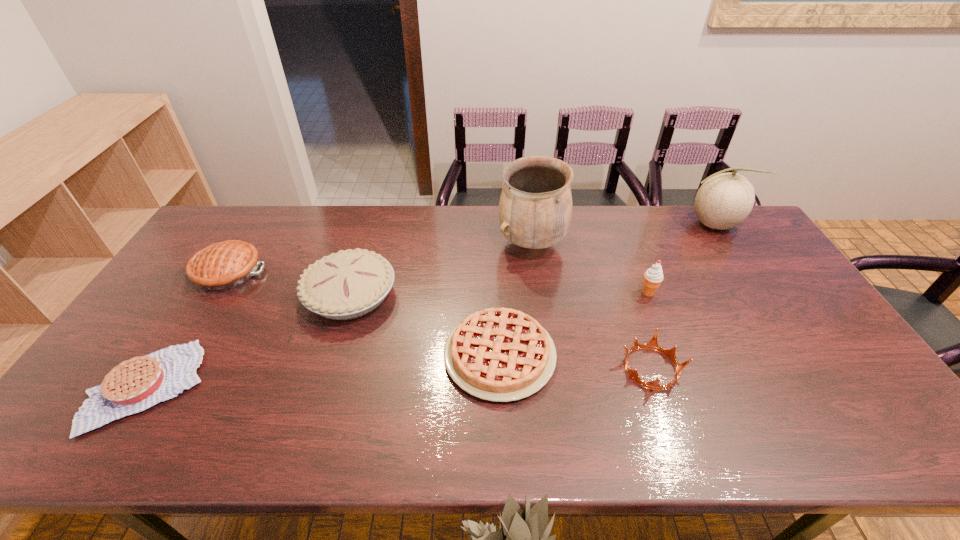
Where is `empty space that is in between the seventh tallest object and the shortest object`? Image resolution: width=960 pixels, height=540 pixels. empty space that is in between the seventh tallest object and the shortest object is located at coordinates (324, 371).

Locate an element on the screen. The height and width of the screenshot is (540, 960). vacant space that's between the second tallest pie and the crown is located at coordinates (440, 320).

This screenshot has width=960, height=540. In order to click on vacant point located between the rightmost pie and the third shortest object in this screenshot , I will do `click(576, 362)`.

Where is `vacant area that lies between the third shortest object and the shortest pie`? vacant area that lies between the third shortest object and the shortest pie is located at coordinates coord(399,377).

I want to click on free spot between the rightmost object and the fifth tallest object, so click(x=470, y=248).

Where is `vacant space that is in between the rightmost object and the urn`? The width and height of the screenshot is (960, 540). vacant space that is in between the rightmost object and the urn is located at coordinates (622, 234).

Where is `object that stands as the fourth closest to the third shortest pie`? object that stands as the fourth closest to the third shortest pie is located at coordinates (535, 208).

Where is `object identified as the fourth closest to the sixth tallest object`? object identified as the fourth closest to the sixth tallest object is located at coordinates (724, 200).

Identify which pie is located as the nearest to the second pie from right to left. Please provide its 2D coordinates. Your answer should be formatted as a tuple, i.e. [(x, y)], where the tuple contains the x and y coordinates of a point satisfying the conditions above.

[(222, 266)]

Locate an element on the screen. The height and width of the screenshot is (540, 960). the closest pie relative to the third pie from left to right is located at coordinates (222, 266).